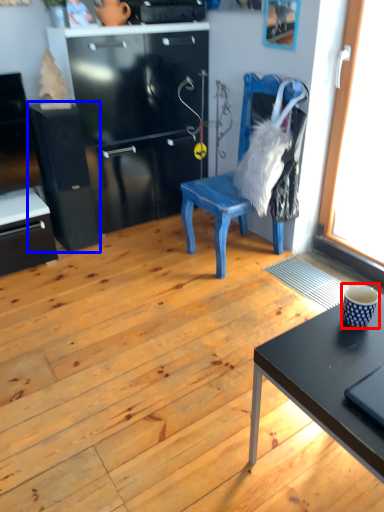
Question: Which object is closer to the camera taking this photo, coffee cup (highlighted by a red box) or file cabinet (highlighted by a blue box)?

Choices:
 (A) coffee cup
 (B) file cabinet

Answer: (A)